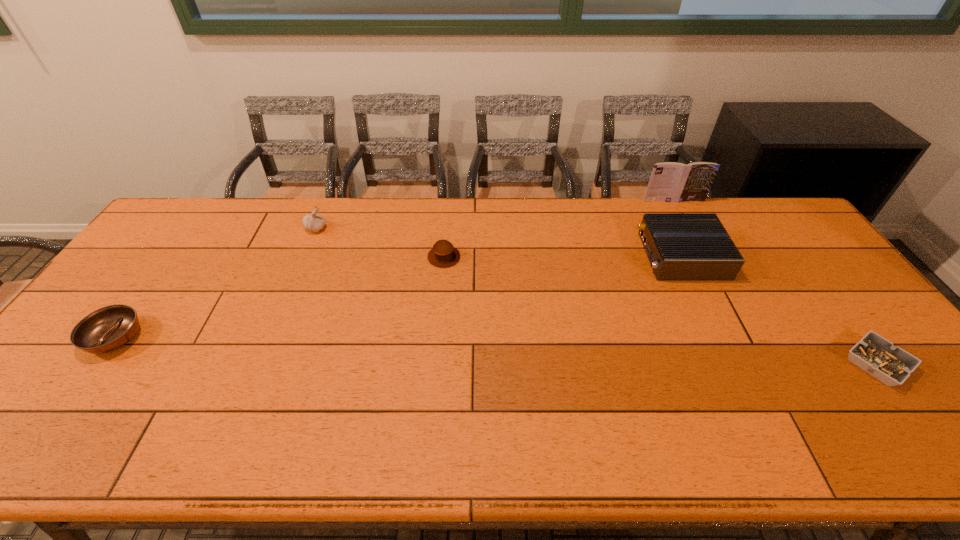
You are a GUI agent. You are given a task and a screenshot of the screen. Output one action in this format:
    pyautogui.click(x=<x>, y=<y>)
    Task: Click on the free space located on the front of the fifth object from right to left
    
    Given the screenshot: What is the action you would take?
    pyautogui.click(x=284, y=303)

The width and height of the screenshot is (960, 540). Identify the location of vacant position located 0.290m on the back panel of the router. (548, 256).

Identify the location of free space located 0.180m on the back panel of the router. (584, 256).

Identify the location of vacant space located 0.170m on the back panel of the router. This screenshot has height=540, width=960. (587, 256).

At what (x,y) coordinates should I click in order to perform the action: click on vacant space situated 0.080m on the back of the fourth object from right to left. Please return your answer as a coordinate pair (x, y). Looking at the image, I should click on (446, 231).

Where is `vacant space located on the right of the fifth tallest object`? This screenshot has height=540, width=960. vacant space located on the right of the fifth tallest object is located at coordinates (211, 338).

Where is `vacant area situated 0.350m on the left of the rightmost object`? This screenshot has height=540, width=960. vacant area situated 0.350m on the left of the rightmost object is located at coordinates (705, 364).

Identify the location of book positioned at the far edge. This screenshot has width=960, height=540. (672, 182).

Find the location of `garlic present at the far edge`. garlic present at the far edge is located at coordinates (314, 222).

The height and width of the screenshot is (540, 960). Find the location of `router situated at the far edge`. router situated at the far edge is located at coordinates (679, 246).